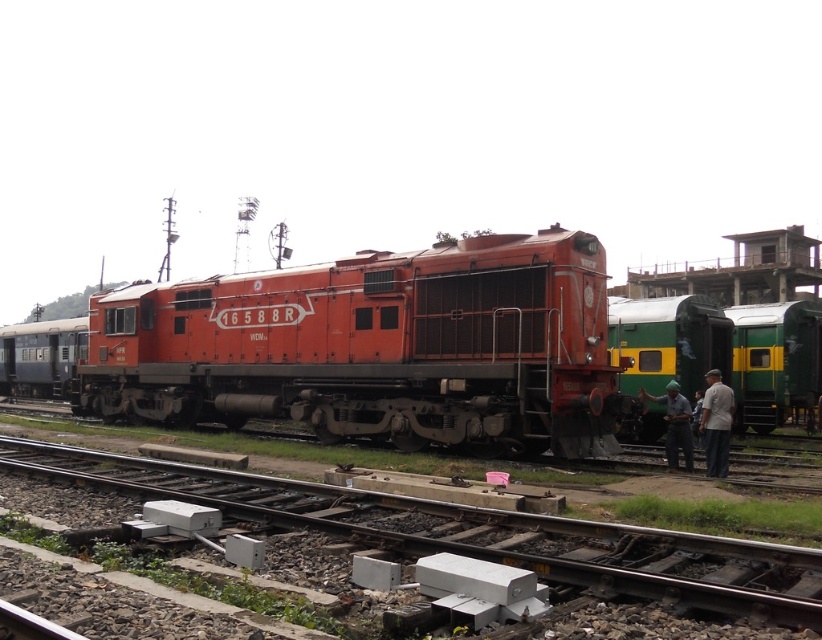
Question: Can you confirm if matte orange locomotive at center is positioned to the right of metal at center?

Choices:
 (A) no
 (B) yes

Answer: (A)

Question: Does metal at center appear on the right side of green fabric cap at lower right?

Choices:
 (A) yes
 (B) no

Answer: (B)

Question: Among these objects, which one is farthest from the camera?

Choices:
 (A) matte orange locomotive at center
 (B) green fabric cap at lower right
 (C) light gray fabric pants at lower right
 (D) metal at center

Answer: (B)

Question: Is matte orange locomotive at center to the left of green/yellow painted train car at right from the viewer's perspective?

Choices:
 (A) yes
 (B) no

Answer: (A)

Question: Which point is closer to the camera?

Choices:
 (A) green fabric cap at lower right
 (B) light gray fabric pants at lower right
 (C) green/yellow painted train car at right

Answer: (B)

Question: Which of the following is the closest to the observer?

Choices:
 (A) metal at center
 (B) green/yellow painted train car at right
 (C) green fabric cap at lower right
 (D) matte orange locomotive at center

Answer: (A)